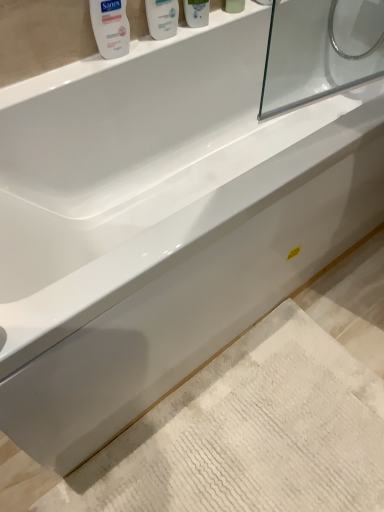
Where is `vacant area that lies to the right of white glossy mouthwash at upper left, the fourth mouthwash from the right`? The image size is (384, 512). vacant area that lies to the right of white glossy mouthwash at upper left, the fourth mouthwash from the right is located at coordinates (150, 49).